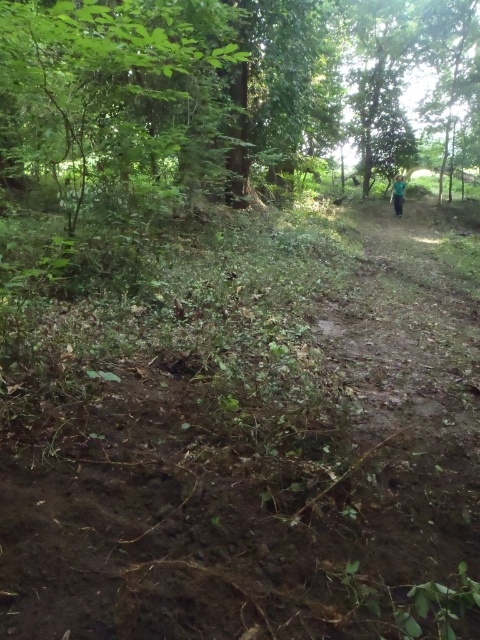
Question: Among these points, which one is farthest from the camera?

Choices:
 (A) (x=395, y=193)
 (B) (x=219, y=540)

Answer: (A)

Question: Does brown dirt track at center appear on the left side of green fabric person at upper right?

Choices:
 (A) yes
 (B) no

Answer: (A)

Question: Is brown dirt track at center below green fabric person at upper right?

Choices:
 (A) no
 (B) yes

Answer: (B)

Question: Which point appears closest to the camera in this image?

Choices:
 (A) (397, 173)
 (B) (354, 465)

Answer: (B)

Question: Among these points, which one is farthest from the camera?

Choices:
 (A) (396, 195)
 (B) (40, 582)

Answer: (A)

Question: Can you confirm if brown dirt track at center is smaller than green fabric person at upper right?

Choices:
 (A) yes
 (B) no

Answer: (A)